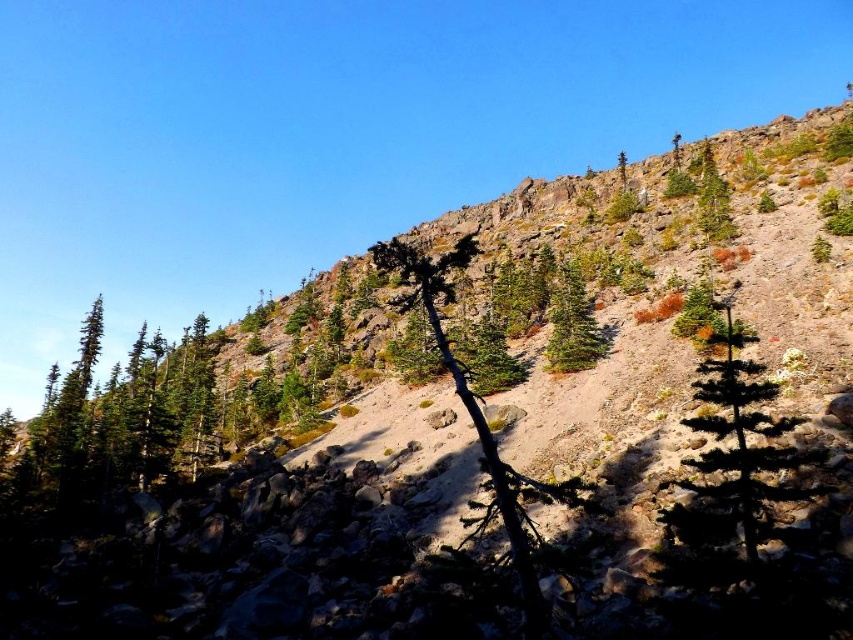
Question: Among these objects, which one is farthest from the camera?

Choices:
 (A) green matte tree at center-right
 (B) green matte tree at center
 (C) green rough bark tree at center

Answer: (B)

Question: Does green matte tree at center appear on the left side of green matte tree at upper center?

Choices:
 (A) yes
 (B) no

Answer: (A)

Question: Which point is closer to the camera taking this photo?

Choices:
 (A) (560, 371)
 (B) (741, 362)
 (C) (618, 157)

Answer: (B)

Question: Does green matte tree at center-right have a larger size compared to green rough bark tree at center?

Choices:
 (A) yes
 (B) no

Answer: (B)

Question: Which of these objects is positioned farthest from the green matte tree at center-right?

Choices:
 (A) green matte tree at center
 (B) green rough bark tree at center

Answer: (A)

Question: Can you confirm if green matte tree at center-right is wider than green matte tree at upper center?

Choices:
 (A) yes
 (B) no

Answer: (A)